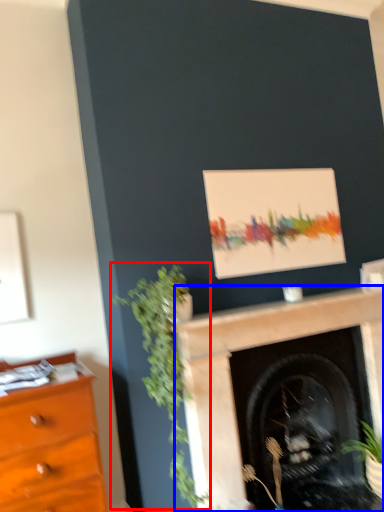
Question: Which object is further to the camera taking this photo, plant (highlighted by a red box) or fireplace (highlighted by a blue box)?

Choices:
 (A) plant
 (B) fireplace

Answer: (B)